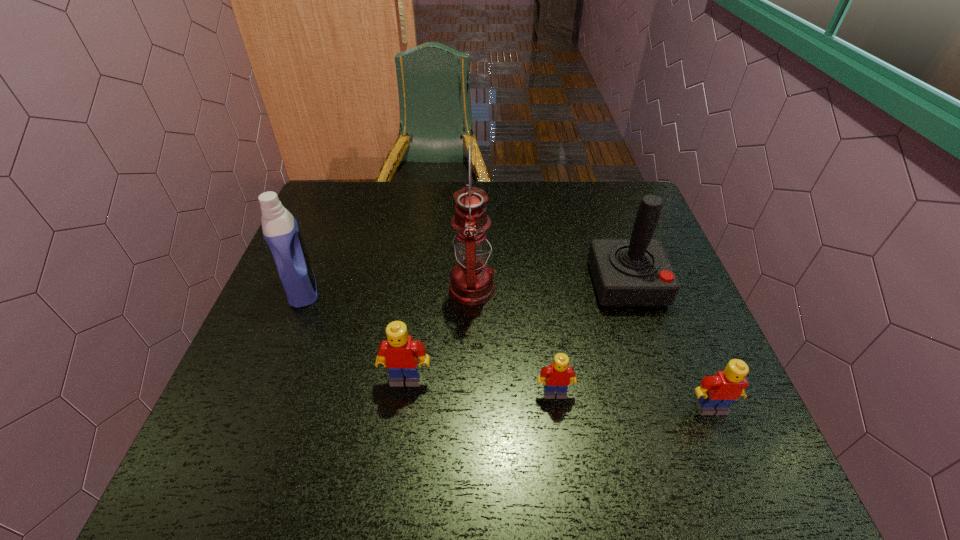
You are a GUI agent. You are given a task and a screenshot of the screen. Output one action in this format:
    pyautogui.click(x=<x>, y=<y>)
    Task: Click on the object that stands as the closest to the joystick
    This screenshot has width=960, height=540.
    Given the screenshot: What is the action you would take?
    pyautogui.click(x=559, y=375)

At what (x,y) coordinates should I click in order to perform the action: click on object that is the closest to the second object from left to right. Please return your answer as a coordinate pair (x, y). This screenshot has width=960, height=540. Looking at the image, I should click on (472, 283).

You are a GUI agent. You are given a task and a screenshot of the screen. Output one action in this format:
    pyautogui.click(x=<x>, y=<y>)
    Task: Click on the Lego that is the second nearest to the shortest Lego
    This screenshot has height=540, width=960.
    Given the screenshot: What is the action you would take?
    [x=715, y=395]

This screenshot has height=540, width=960. Find the location of `the second closest Lego to the oil lamp`. the second closest Lego to the oil lamp is located at coordinates (559, 375).